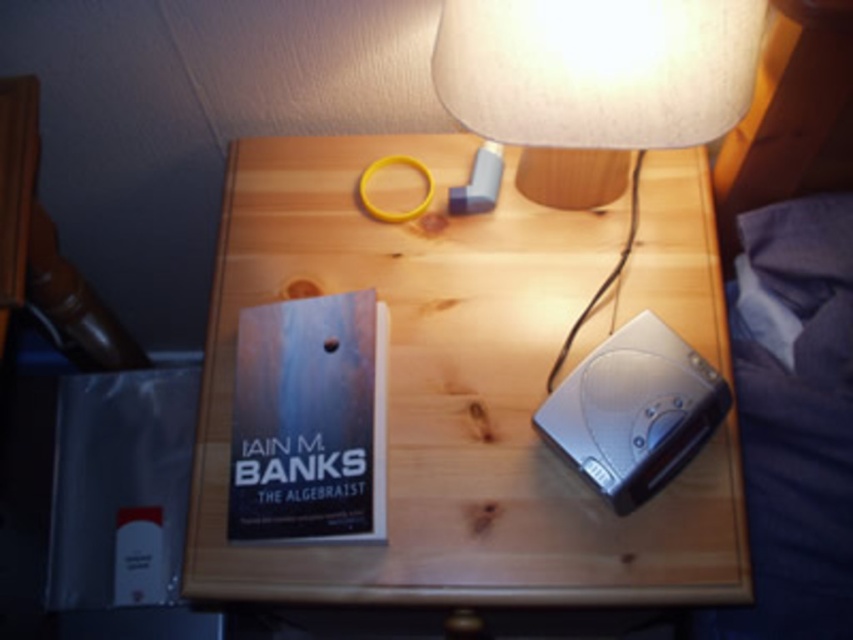
Between point (500, 115) and point (294, 307), which one is positioned in front?

Positioned in front is point (500, 115).

Does matte beige lampshade at upper center have a larger size compared to hardcover book at center?

Correct, matte beige lampshade at upper center is larger in size than hardcover book at center.

Which is in front, point (695, 115) or point (370, 502)?

Point (695, 115) is in front.

This screenshot has height=640, width=853. Find the location of `matte beige lampshade at upper center`. matte beige lampshade at upper center is located at coordinates (596, 68).

Does wooden table at center appear on the left side of hardcover book at center?

Incorrect, wooden table at center is not on the left side of hardcover book at center.

Is wooden table at center positioned behind hardcover book at center?

No, wooden table at center is in front of hardcover book at center.

Is point (395, 276) positioned behind point (320, 518)?

Yes, point (395, 276) is behind point (320, 518).

Find the location of a particular element. wooden table at center is located at coordinates (447, 397).

Is point (486, 266) positioned in front of point (494, 140)?

No.

Can you confirm if wooden table at center is positioned below matte beige lampshade at upper center?

Correct, wooden table at center is located below matte beige lampshade at upper center.

Measure the distance between point [477,298] and camera.

Point [477,298] is 83.76 centimeters away from camera.

I want to click on wooden table at center, so click(x=447, y=397).